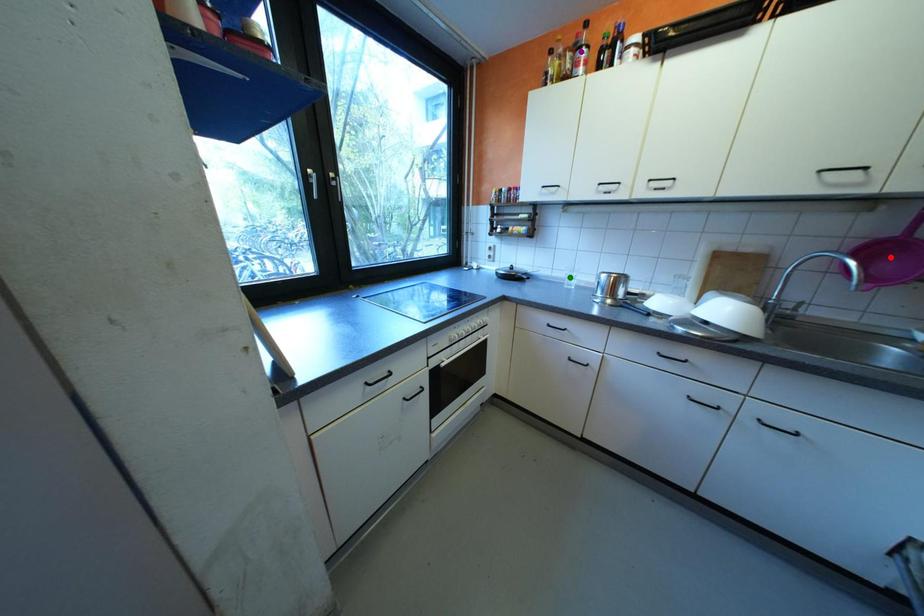
Order these from nearest to farthest:
purple point
green point
red point

red point, purple point, green point